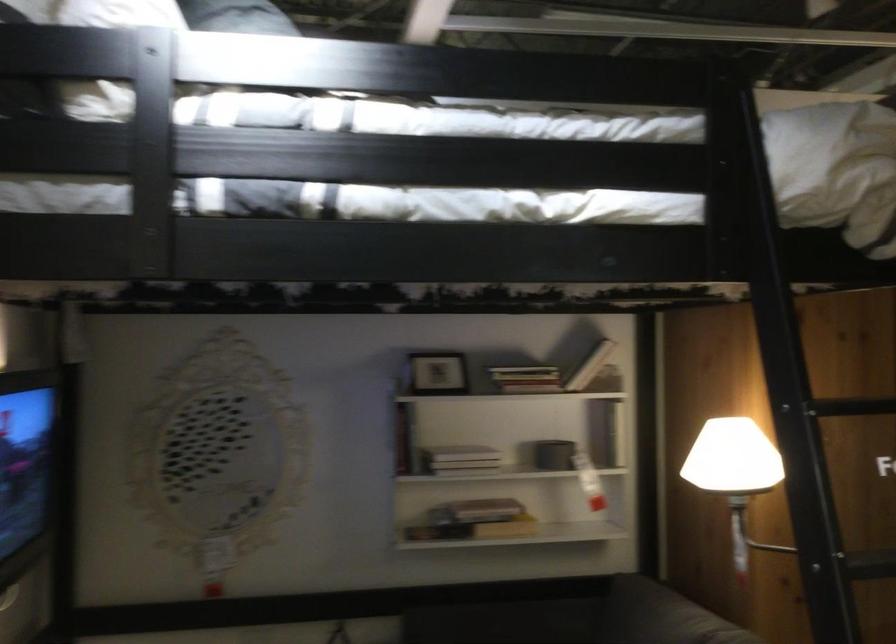
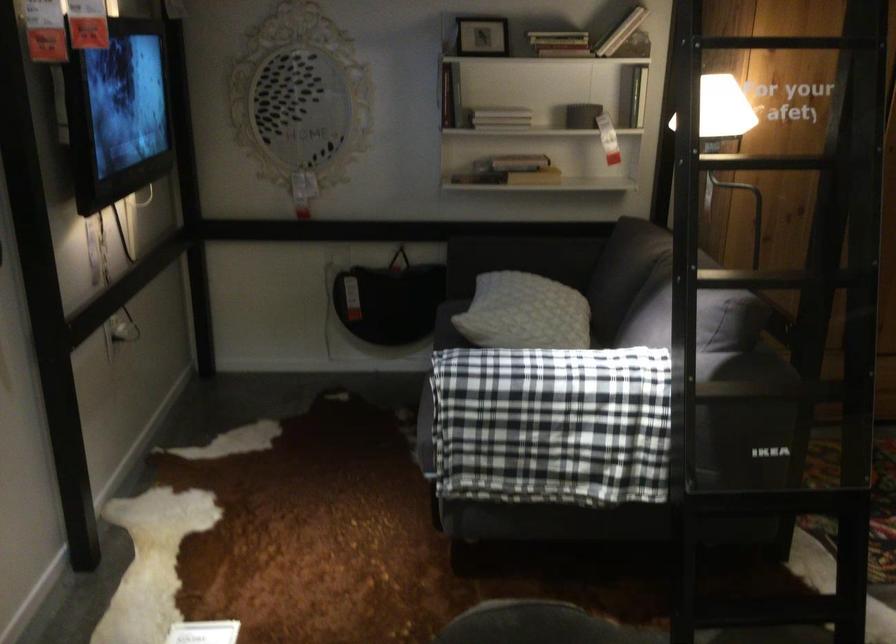
Question: I am providing you with two images of the same scene from different viewpoints. After the viewpoint changes to image2, which objects are now occluded?

Choices:
 (A) white lamp head
 (B) book on shelf
 (C) blue fabric sitting surface
 (D) white patterned cushion

Answer: (A)